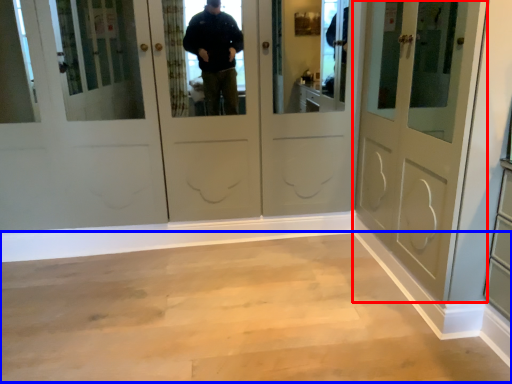
Question: Among these objects, which one is nearest to the camera, door (highlighted by a red box) or corridor (highlighted by a blue box)?

Choices:
 (A) door
 (B) corridor

Answer: (A)